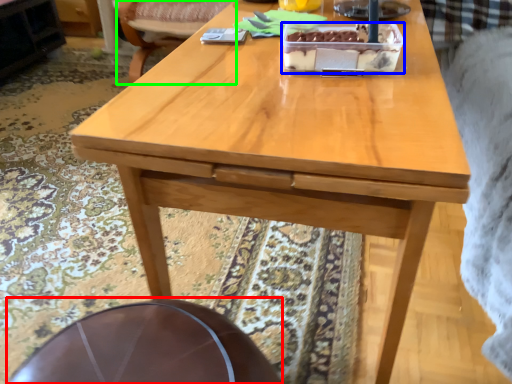
Question: Based on their relative distances, which object is farther from round table (highlighted by a red box)? Choose from cake (highlighted by a blue box) and chair (highlighted by a green box).

Choices:
 (A) cake
 (B) chair

Answer: (B)